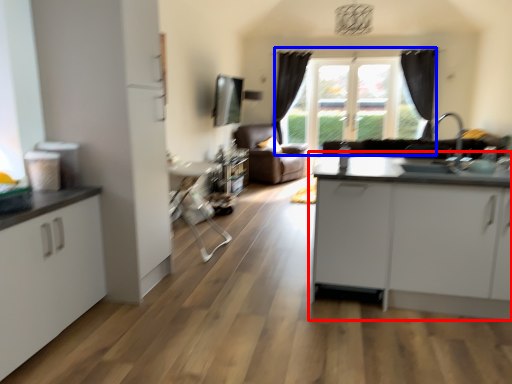
Question: Among these objects, which one is nearest to the camera, table (highlighted by a red box) or window (highlighted by a blue box)?

Choices:
 (A) table
 (B) window

Answer: (A)